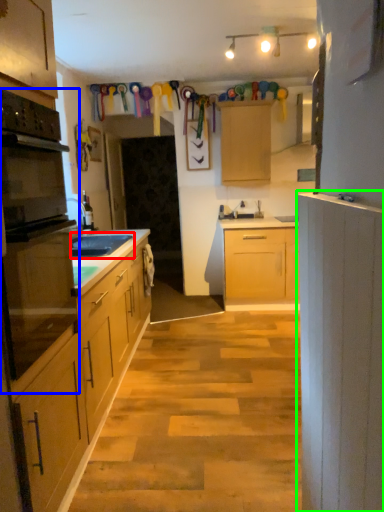
Question: Which is nearer to the sink (highlighted by a red box)? oven (highlighted by a blue box) or cabinetry (highlighted by a green box).

Choices:
 (A) oven
 (B) cabinetry

Answer: (A)